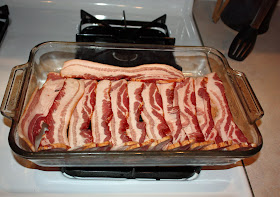
This screenshot has width=280, height=197. I want to click on stove, so click(15, 181).